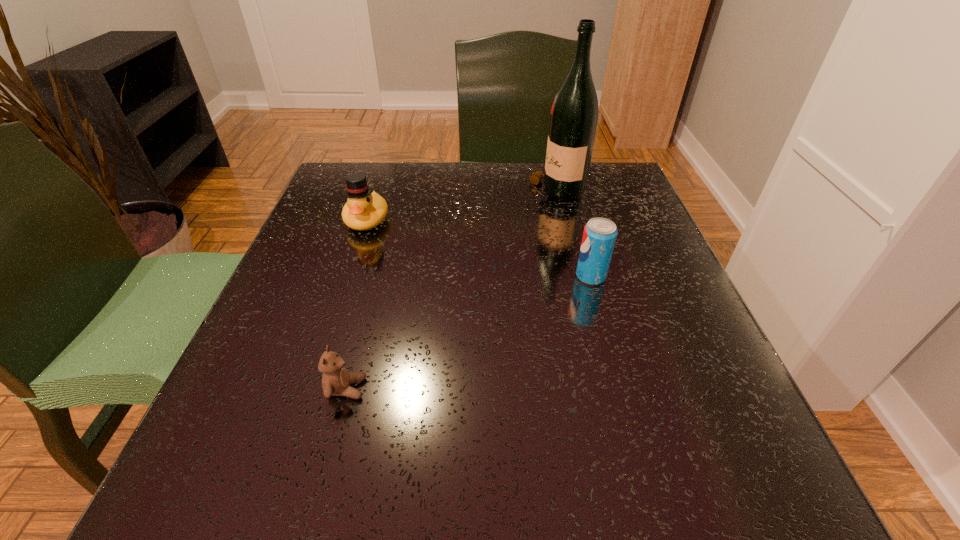
Find the location of a particular element. free spot that satisfies the following two spatial constraints: 1. on the surface of the wine bottle; 2. on the front-facing side of the duck is located at coordinates (562, 220).

The width and height of the screenshot is (960, 540). I want to click on vacant position in the image that satisfies the following two spatial constraints: 1. on the surface of the soda can; 2. on the left side of the tallest object, so click(x=575, y=276).

Locate an element on the screen. The width and height of the screenshot is (960, 540). vacant space that satisfies the following two spatial constraints: 1. on the surface of the wine bottle; 2. on the right side of the second nearest object is located at coordinates (575, 276).

Identify the location of free space that satisfies the following two spatial constraints: 1. on the front-facing side of the duck; 2. on the left side of the second nearest object. (348, 276).